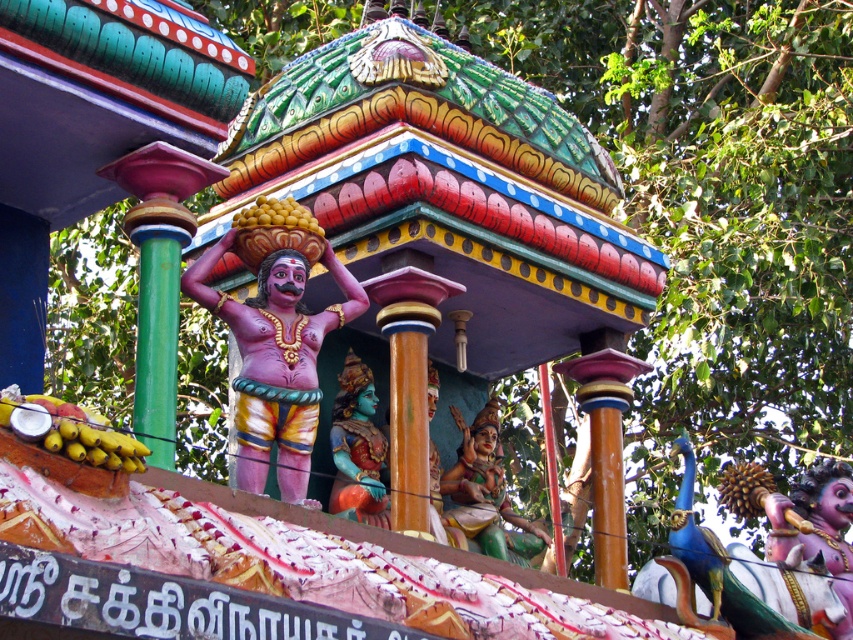
Can you confirm if saffron-colored textured fruit at center is bigger than yellow matte bananas at center?

Yes, saffron-colored textured fruit at center is bigger than yellow matte bananas at center.

Who is shorter, saffron-colored textured fruit at center or yellow matte bananas at center?

yellow matte bananas at center is shorter.

Image resolution: width=853 pixels, height=640 pixels. Find the location of `saffron-colored textured fruit at center`. saffron-colored textured fruit at center is located at coordinates (744, 488).

Is teal painted statue at center thinner than yellow matte bananas at center?

No, teal painted statue at center is not thinner than yellow matte bananas at center.

Can you confirm if teal painted statue at center is positioned to the left of yellow matte bananas at center?

No, teal painted statue at center is not to the left of yellow matte bananas at center.

Who is more forward, (349, 372) or (259, 218)?

Point (259, 218) is more forward.

The width and height of the screenshot is (853, 640). Identify the location of teal painted statue at center. (358, 449).

Between polished pink statue at center and saffron-colored textured fruit at center, which one is positioned lower?

polished pink statue at center

Who is more forward, (840, 636) or (729, 502)?

Point (840, 636) is more forward.

Which is behind, point (848, 611) or point (757, 502)?

The point (757, 502) is behind.

At what (x,y) coordinates should I click in order to perform the action: click on polished pink statue at center. Please return your answer as a coordinate pair (x, y). Looking at the image, I should click on (817, 528).